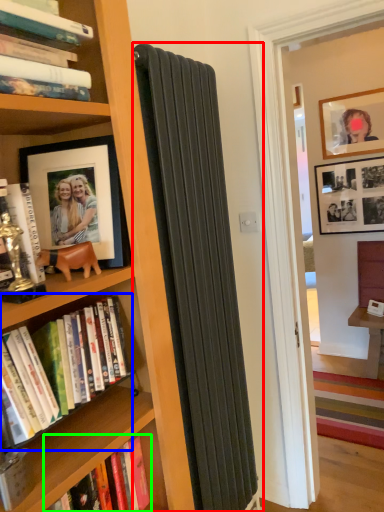
Question: Based on their relative distances, which object is nearer to curtain (highlighted by a red box)? Choose from book (highlighted by a blue box) and book (highlighted by a green box).

Choices:
 (A) book
 (B) book

Answer: (A)